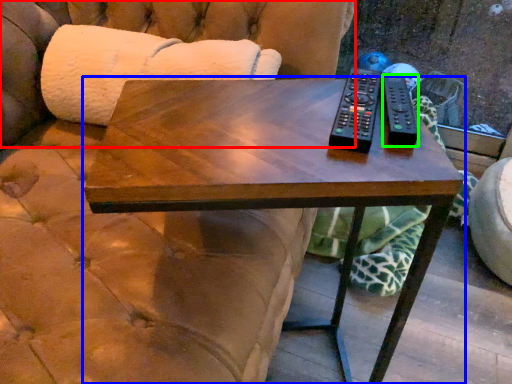
Question: Which object is positioned farthest from couch (highlighted by a red box)? Select from coffee table (highlighted by a blue box) and remote (highlighted by a green box).

Choices:
 (A) coffee table
 (B) remote

Answer: (B)